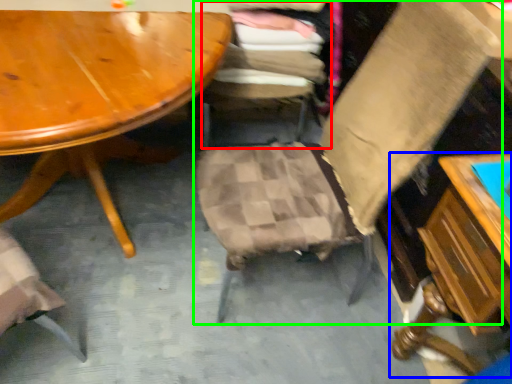
Question: Based on their relative distances, which object is farther from chair (highlighted by a red box)? Choose from table (highlighted by a blue box) and chair (highlighted by a green box).

Choices:
 (A) table
 (B) chair

Answer: (A)